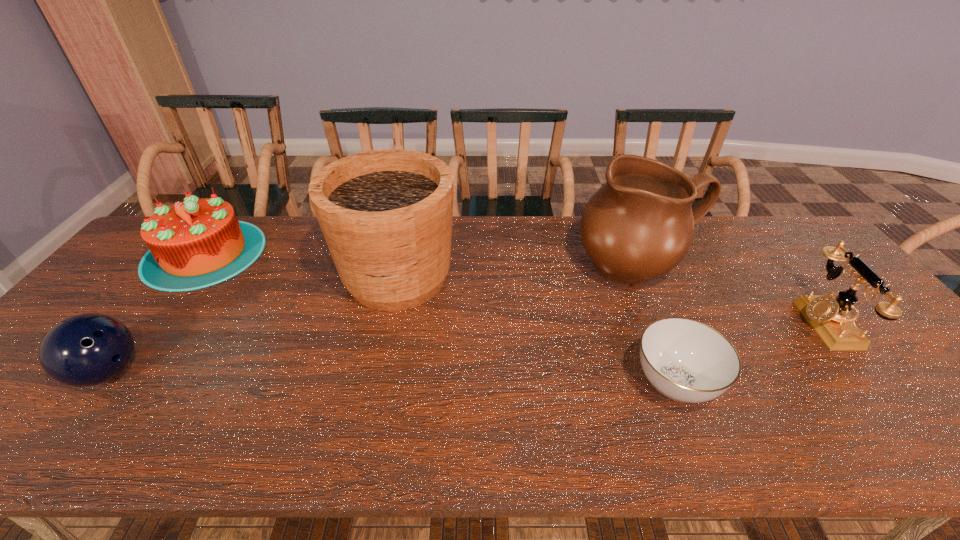
The height and width of the screenshot is (540, 960). Identify the location of free space located on the dial of the rightmost object. (767, 323).

Find the location of `free space located 0.210m on the dial of the rightmost object`. free space located 0.210m on the dial of the rightmost object is located at coordinates (722, 323).

Locate an element on the screen. The height and width of the screenshot is (540, 960). vacant space located 0.050m on the surface of the bowling ball near the finger holes is located at coordinates (164, 372).

Locate an element on the screen. The width and height of the screenshot is (960, 540). vacant space situated on the back of the chinaware is located at coordinates (627, 262).

Image resolution: width=960 pixels, height=540 pixels. What are the coordinates of `cream pitcher that is positioned at the far edge` in the screenshot? It's located at (639, 225).

You are a GUI agent. You are given a task and a screenshot of the screen. Output one action in this format:
    pyautogui.click(x=<x>, y=<y>)
    Task: Click on the flowerpot that is at the far edge
    This screenshot has width=960, height=540.
    Given the screenshot: What is the action you would take?
    pyautogui.click(x=386, y=215)

The height and width of the screenshot is (540, 960). Identify the location of cake located at the far edge. (197, 243).

This screenshot has height=540, width=960. What are the coordinates of `object at the near edge` in the screenshot? It's located at (687, 361).

The image size is (960, 540). Identify the location of cake at the left edge. (197, 243).

You are a GUI agent. You are given a task and a screenshot of the screen. Output one action in this format:
    pyautogui.click(x=<x>, y=<y>)
    Task: Click on the bowling ball that is at the left edge
    The width and height of the screenshot is (960, 540).
    Given the screenshot: What is the action you would take?
    pyautogui.click(x=85, y=350)